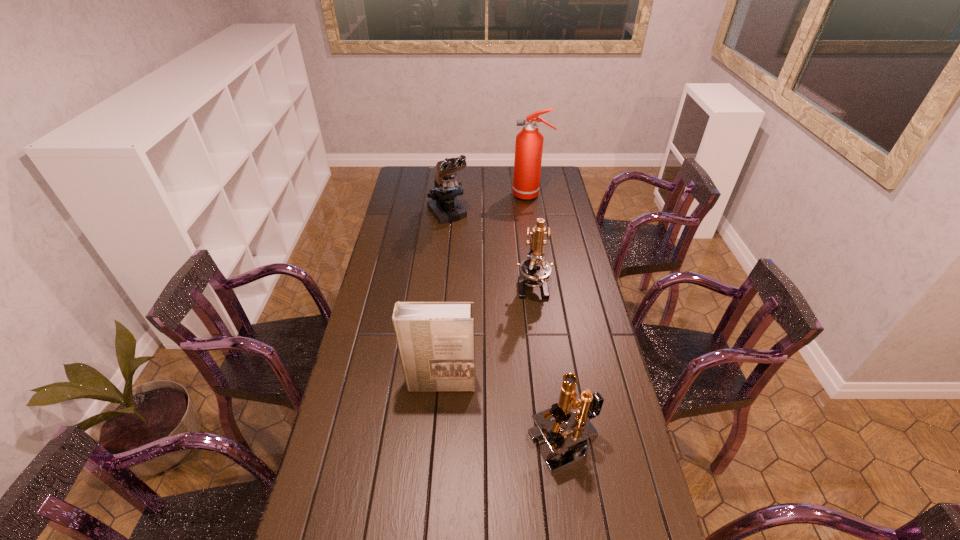
Locate which object ranks third in proximity to the phonebook. Please provide its 2D coordinates. Your answer should be formatted as a tuple, i.e. [(x, y)], where the tuple contains the x and y coordinates of a point satisfying the conditions above.

[(446, 208)]

This screenshot has width=960, height=540. In order to click on the second closest object to the farthest microscope in this screenshot , I will do `click(535, 271)`.

The height and width of the screenshot is (540, 960). Identify the location of microscope that stands as the closest to the tallest object. (446, 208).

Select which microscope is the second closest to the third farthest object. Please provide its 2D coordinates. Your answer should be formatted as a tuple, i.e. [(x, y)], where the tuple contains the x and y coordinates of a point satisfying the conditions above.

[(561, 428)]

Where is `vacant space that satisfies the following two spatial constraints: 1. at the nozzle of the fire extinguisher; 2. on the front side of the leftmost microscope`? The image size is (960, 540). vacant space that satisfies the following two spatial constraints: 1. at the nozzle of the fire extinguisher; 2. on the front side of the leftmost microscope is located at coordinates (534, 214).

You are a GUI agent. You are given a task and a screenshot of the screen. Output one action in this format:
    pyautogui.click(x=<x>, y=<y>)
    Task: Click on the vacant region that satisfies the following two spatial constraints: 1. at the nozzle of the fire extinguisher; 2. on the front side of the leftmost microscope
    
    Given the screenshot: What is the action you would take?
    pyautogui.click(x=534, y=214)